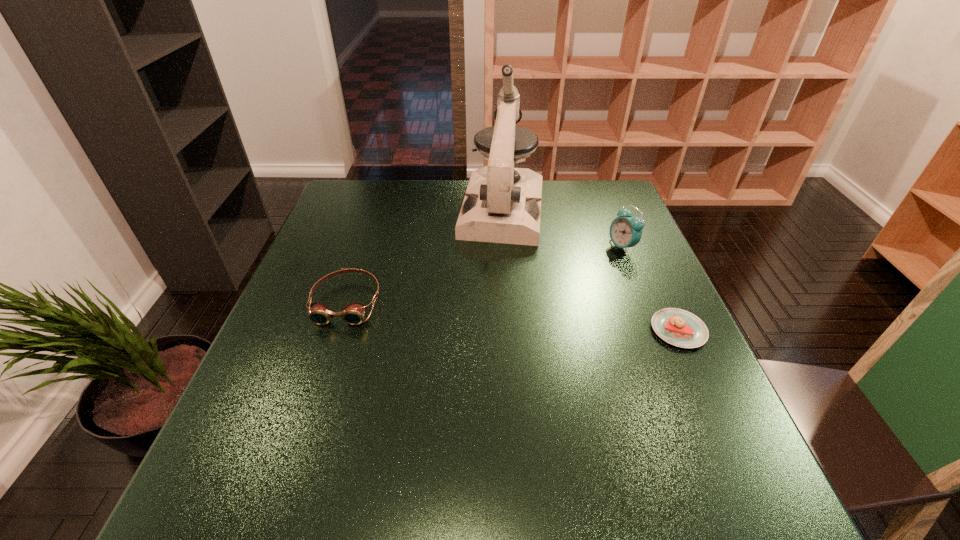
Find the location of a particular element. This screenshot has height=540, width=960. the leftmost object is located at coordinates (353, 313).

The height and width of the screenshot is (540, 960). What are the coordinates of `the second shortest object` in the screenshot? It's located at (353, 313).

What are the coordinates of `the shortest object` in the screenshot? It's located at [x=678, y=327].

At what (x,y) coordinates should I click in order to perform the action: click on the second object from left to right. Please return your answer as a coordinate pair (x, y). The height and width of the screenshot is (540, 960). Looking at the image, I should click on (502, 204).

Locate an element on the screen. Image resolution: width=960 pixels, height=540 pixels. the tallest object is located at coordinates (502, 204).

In order to click on the third shortest object in this screenshot , I will do `click(625, 231)`.

Where is `free point located 0.170m through the lenses of the leftmost object`? The width and height of the screenshot is (960, 540). free point located 0.170m through the lenses of the leftmost object is located at coordinates (317, 392).

Where is `vacant space positioned on the left of the pastry`? vacant space positioned on the left of the pastry is located at coordinates (525, 330).

Where is `blank space located at the eyepiece of the microscope`? blank space located at the eyepiece of the microscope is located at coordinates (489, 304).

The image size is (960, 540). Find the location of `blank space located 0.280m at the eyepiece of the microscope`. blank space located 0.280m at the eyepiece of the microscope is located at coordinates (486, 319).